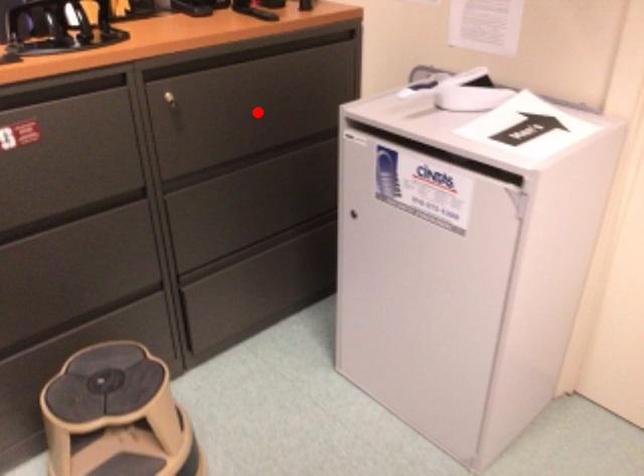
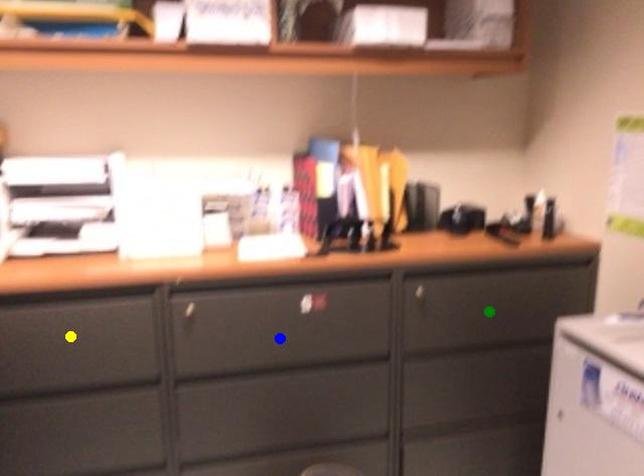
Question: I am providing you with two images of the same scene from different viewpoints. A red point is marked on the first image. You are given multiple points on the second image. Which spot in image 2 lines up with the point in image 1?

Choices:
 (A) yellow point
 (B) green point
 (C) blue point

Answer: (B)